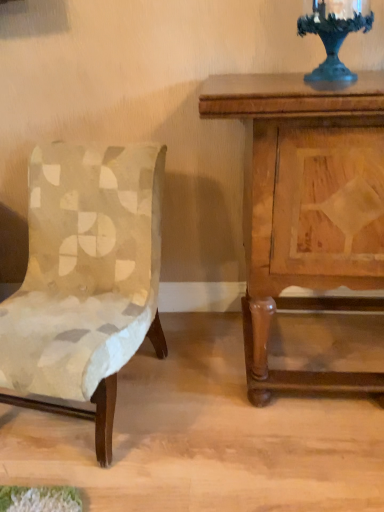
Identify the location of vacant space to the right of velvet beige chair at left. The height and width of the screenshot is (512, 384). (203, 411).